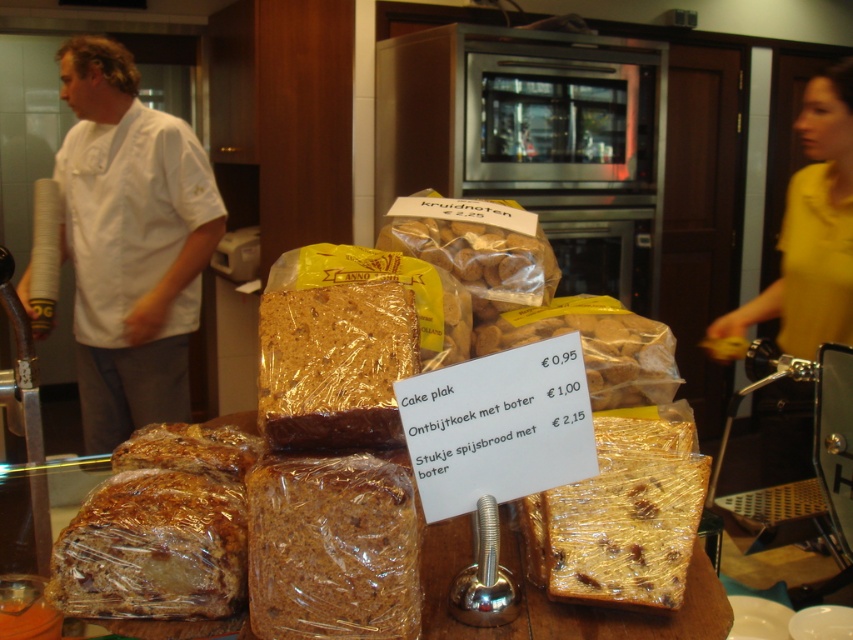
What is the coordinate of the white chef coat at left in the bakery display?

The white chef coat at left is located at coordinate point (131, 241).

What are the coordinates of the brown crumbly cake at center?

The brown crumbly cake at center is located at coordinates point (332, 547).